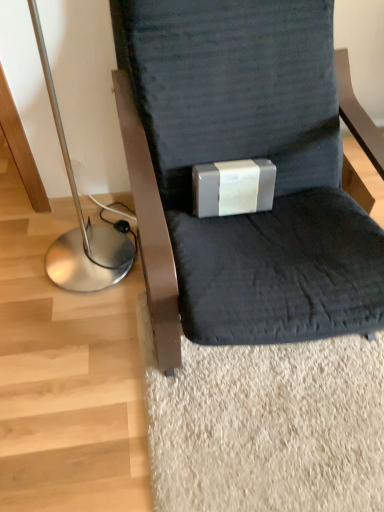
Question: Is matte gray box at center taller or shorter than silver metallic floor lamp at left?

Choices:
 (A) short
 (B) tall

Answer: (A)

Question: Choose the correct answer: Is matte gray box at center inside silver metallic floor lamp at left or outside it?

Choices:
 (A) inside
 (B) outside

Answer: (B)

Question: Which is nearer to the matte gray cushion at center?

Choices:
 (A) silver metallic floor lamp at left
 (B) matte gray box at center

Answer: (B)

Question: Which of these objects is positioned farthest from the silver metallic floor lamp at left?

Choices:
 (A) matte gray box at center
 (B) matte gray cushion at center

Answer: (B)